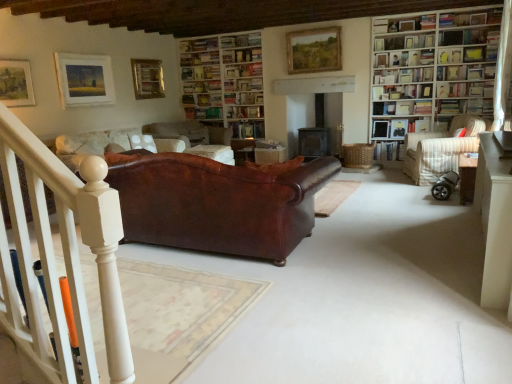
Question: From the image's perspective, is white paper bookshelf at upper right, placed as the fourth book when sorted from left to right, located above or below wooden bookshelf at upper right, acting as the 1th shelf starting from the top?

Choices:
 (A) above
 (B) below

Answer: (B)

Question: From a real-world perspective, is white paper bookshelf at upper right, the 5th book positioned from the right, above or below wooden bookshelf at upper right, acting as the 1th shelf starting from the top?

Choices:
 (A) below
 (B) above

Answer: (A)

Question: Which object is the closest to the white wooden bookcase at right, the second bookcase from the back?

Choices:
 (A) matte white picture frame at upper left, acting as the third picture frame starting from the right
 (B) wooden bookshelf at upper right, positioned as the third shelf in bottom-to-top order
 (C) white paper bookshelf at upper right, the 5th book positioned from the right
 (D) hardcover book at center, which is the 3th book from left to right
 (E) hardcover book at upper right, the 7th book in the left-to-right sequence

Answer: (E)

Question: Estimate the real-world distances between objects in this image. Which object is farther from the white glossy table at lower right, marked as the first table in a front-to-back arrangement?

Choices:
 (A) black rubber baby carriage at lower right
 (B) brown leather cushion at center
 (C) hardcover book at upper right, the eighth book positioned from the left
 (D) hardcover book at center, arranged as the 6th book when viewed from the right
 (E) wooden table at right, the 1th table viewed from the back

Answer: (D)